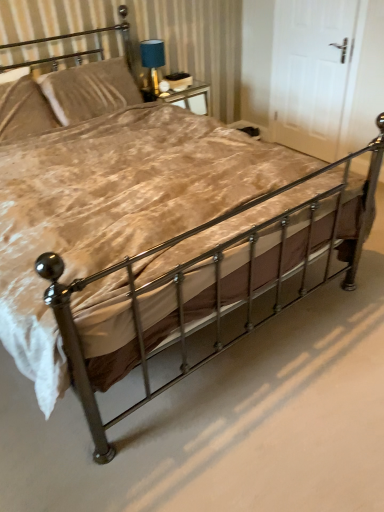
Question: Based on their sizes in the image, would you say metallic gold headboard at upper left is bigger or smaller than velvet beige pillow at upper left, marked as the 2th pillow in a right-to-left arrangement?

Choices:
 (A) small
 (B) big

Answer: (B)

Question: In terms of width, does metallic gold headboard at upper left look wider or thinner when compared to velvet beige pillow at upper left, marked as the first pillow in a left-to-right arrangement?

Choices:
 (A) thin
 (B) wide

Answer: (B)

Question: Considering the real-world distances, which object is closest to the velvet beige pillow at upper left, marked as the 2th pillow in a right-to-left arrangement?

Choices:
 (A) blue fabric lampshade at upper center
 (B) polished metal bed frame at center
 (C) white matte door at upper right
 (D) velvet-like beige pillow at upper left, acting as the first pillow starting from the right
 (E) metallic gold headboard at upper left

Answer: (D)

Question: Considering the real-world distances, which object is farthest from the velvet beige pillow at upper left, marked as the first pillow in a left-to-right arrangement?

Choices:
 (A) white matte door at upper right
 (B) blue fabric lampshade at upper center
 (C) metallic gold headboard at upper left
 (D) polished metal bed frame at center
 (E) velvet-like beige pillow at upper left, the second pillow from the left

Answer: (A)